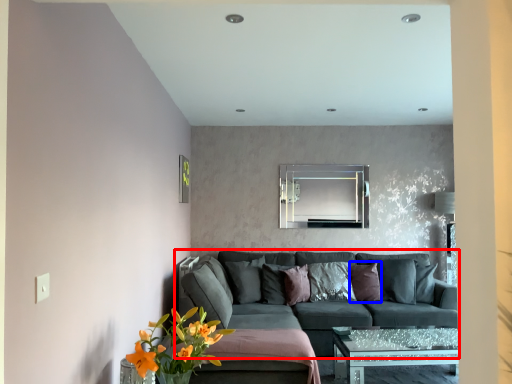
Question: Which object is closer to the camera taking this photo, studio couch (highlighted by a red box) or pillow (highlighted by a blue box)?

Choices:
 (A) studio couch
 (B) pillow

Answer: (A)